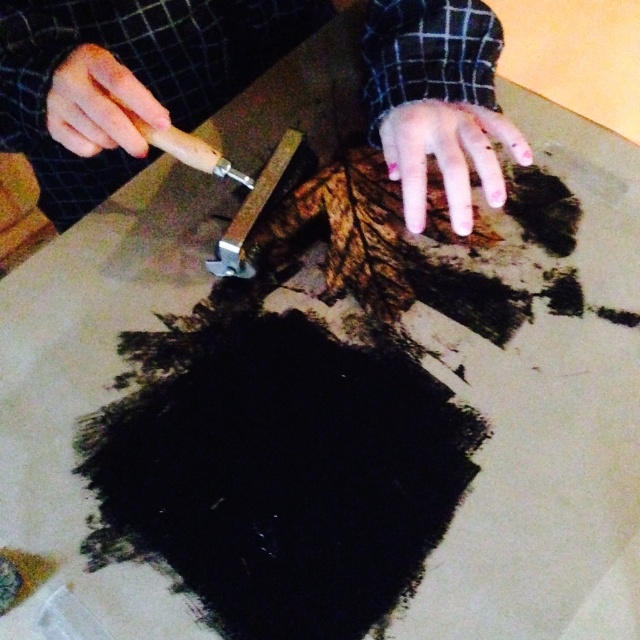
Question: Estimate the real-world distances between objects in this image. Which object is farther from the pale skin at center?

Choices:
 (A) smooth skin hand at upper left
 (B) wooden handle knife at center

Answer: (A)

Question: Does wooden-handled tool at upper center appear over smooth skin hand at upper left?

Choices:
 (A) yes
 (B) no

Answer: (A)

Question: Which object is the closest to the pale skin at center?

Choices:
 (A) smooth skin hand at upper left
 (B) wooden handle knife at center
 (C) wooden-handled tool at upper center

Answer: (B)

Question: Among these points, which one is nearest to the camera?

Choices:
 (A) (282, 195)
 (B) (408, 211)
 (C) (104, 125)

Answer: (C)

Question: Is wooden-handled tool at upper center further to camera compared to pale skin at center?

Choices:
 (A) yes
 (B) no

Answer: (B)

Question: Where is smooth skin hand at upper left located in relation to wooden handle knife at center in the image?

Choices:
 (A) above
 (B) below

Answer: (A)